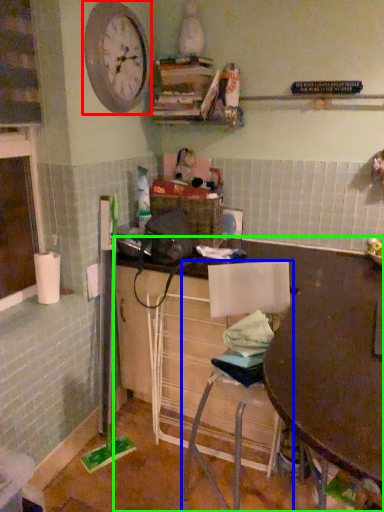
Question: Based on their relative distances, which object is farther from clock (highlighted by a red box)? Choose from chair (highlighted by a blue box) and desk (highlighted by a green box).

Choices:
 (A) chair
 (B) desk

Answer: (B)